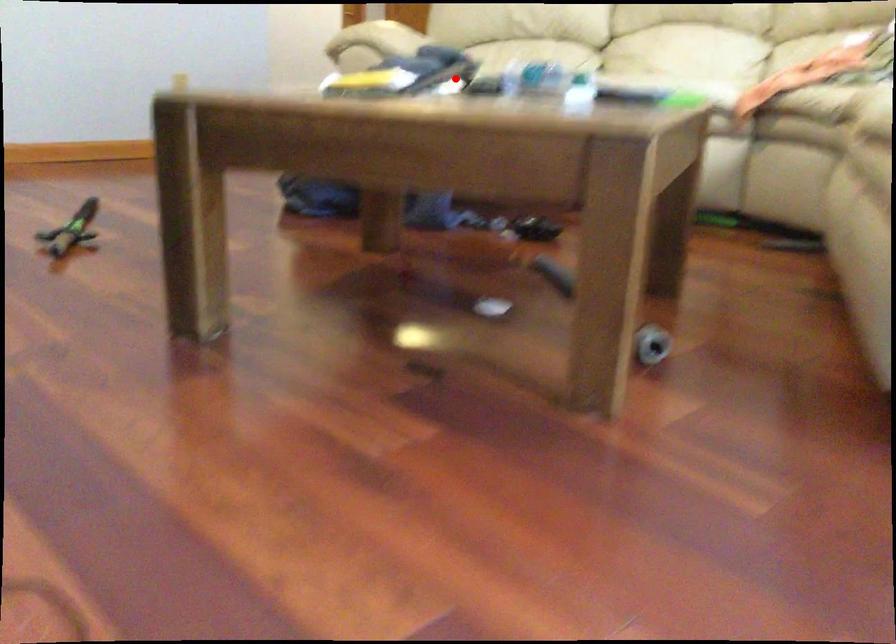
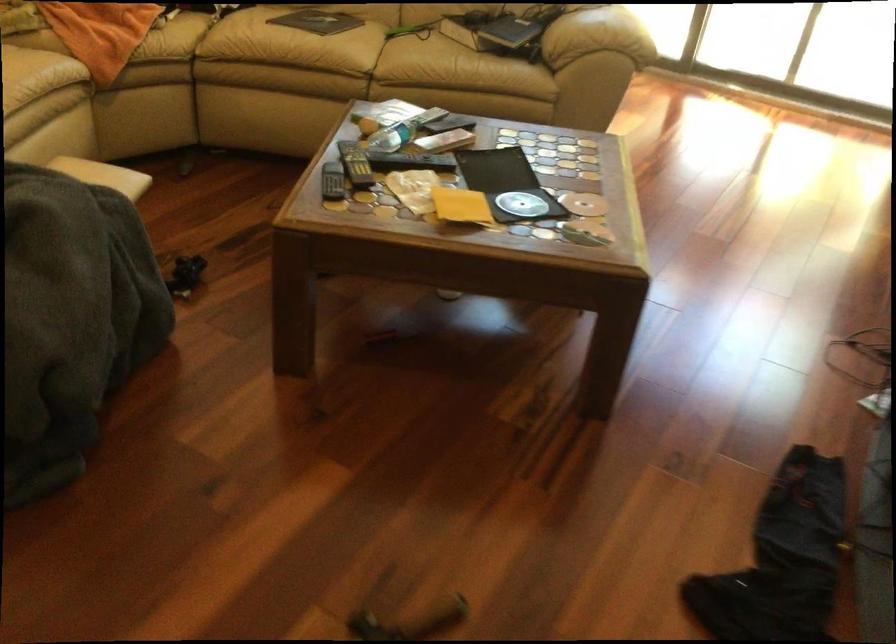
Locate, in the second image, the point that corresponds to the highlighted location in the first image.

(355, 164)